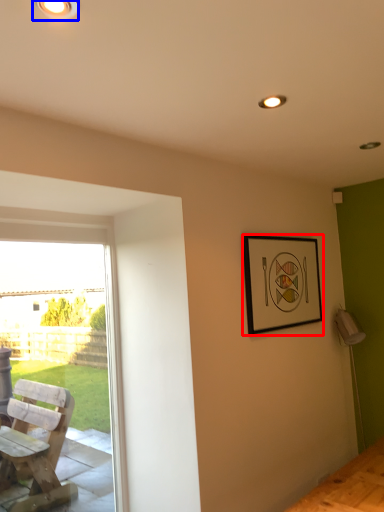
Question: Which object is closer to the camera taking this photo, picture frame (highlighted by a red box) or light fixture (highlighted by a blue box)?

Choices:
 (A) picture frame
 (B) light fixture

Answer: (B)